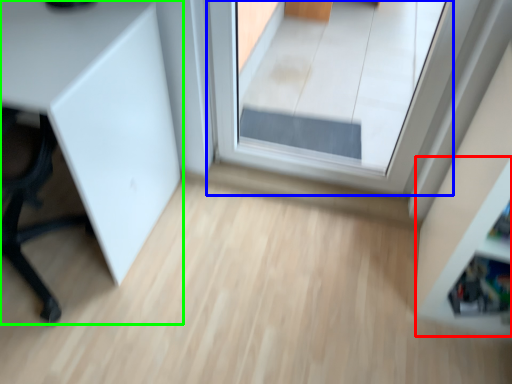
Question: Which object is the farthest from shelf (highlighted by a red box)? Choose among these: window (highlighted by a blue box) or furniture (highlighted by a green box).

Choices:
 (A) window
 (B) furniture

Answer: (A)